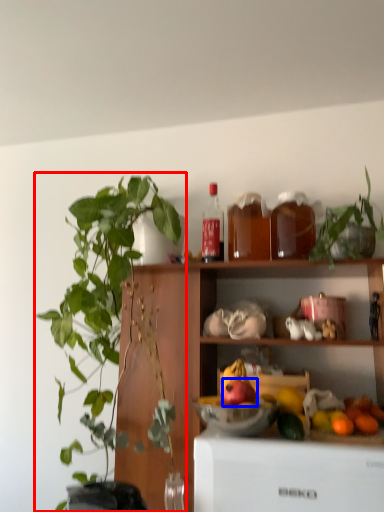
Question: Which object appears closest to the camera in this image, houseplant (highlighted by a red box) or apple (highlighted by a blue box)?

Choices:
 (A) houseplant
 (B) apple

Answer: (A)